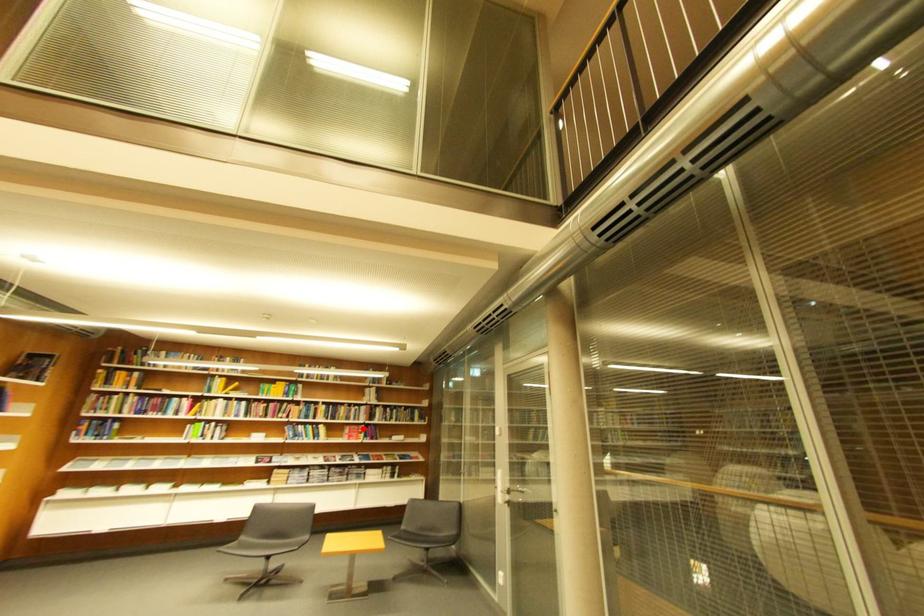
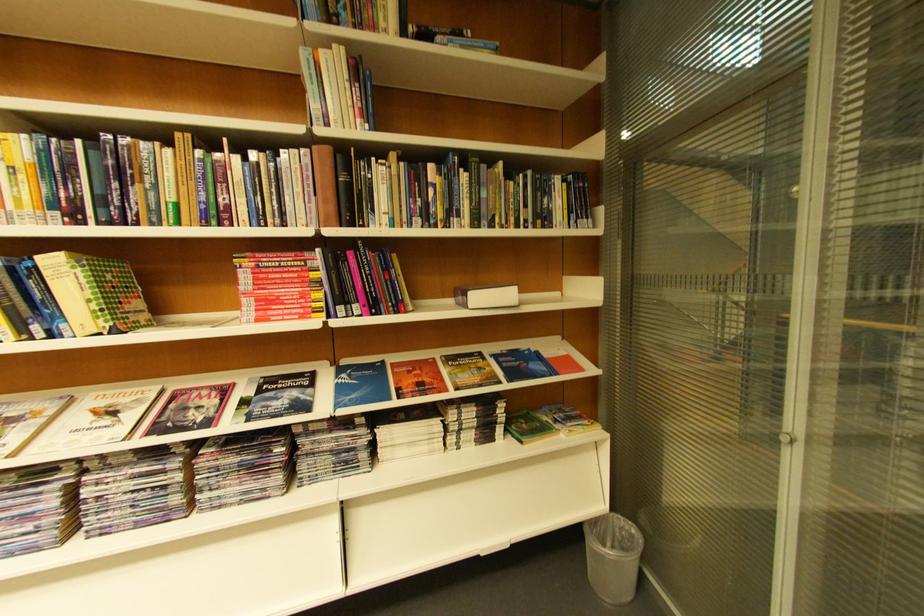
The point at the highlighted location is marked in the first image. Where is the corresponding point in the second image?

(281, 262)